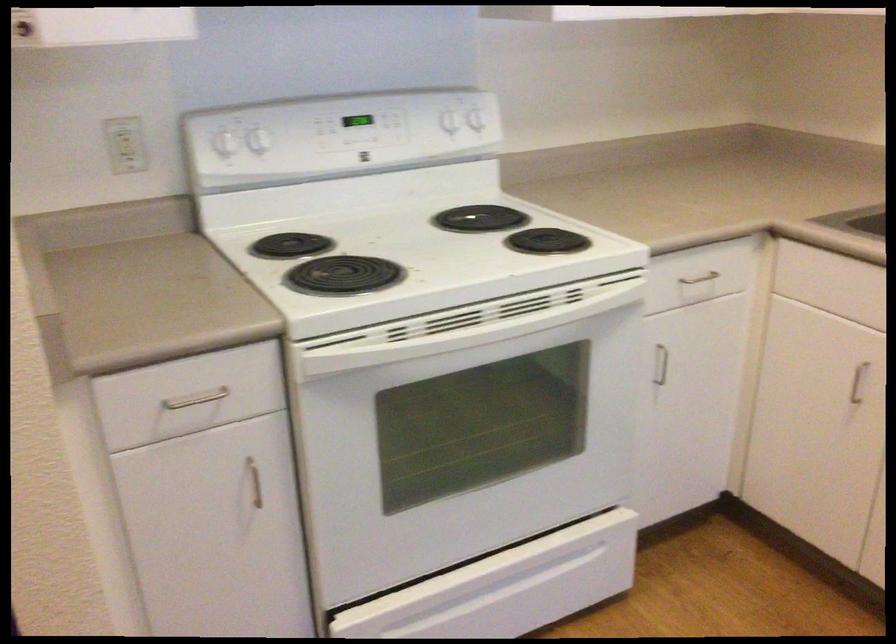
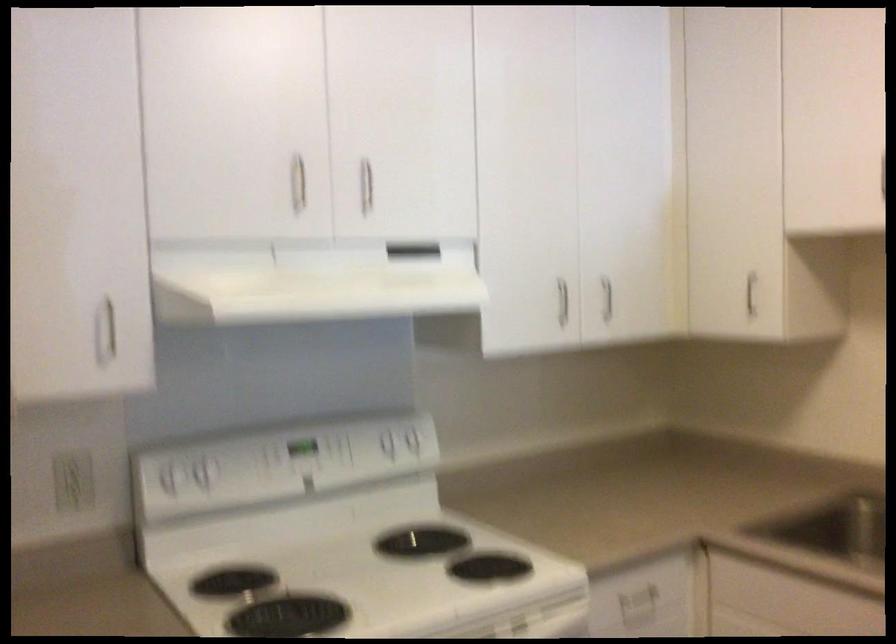
The point at [228,140] is marked in the first image. Where is the corresponding point in the second image?

(169, 476)